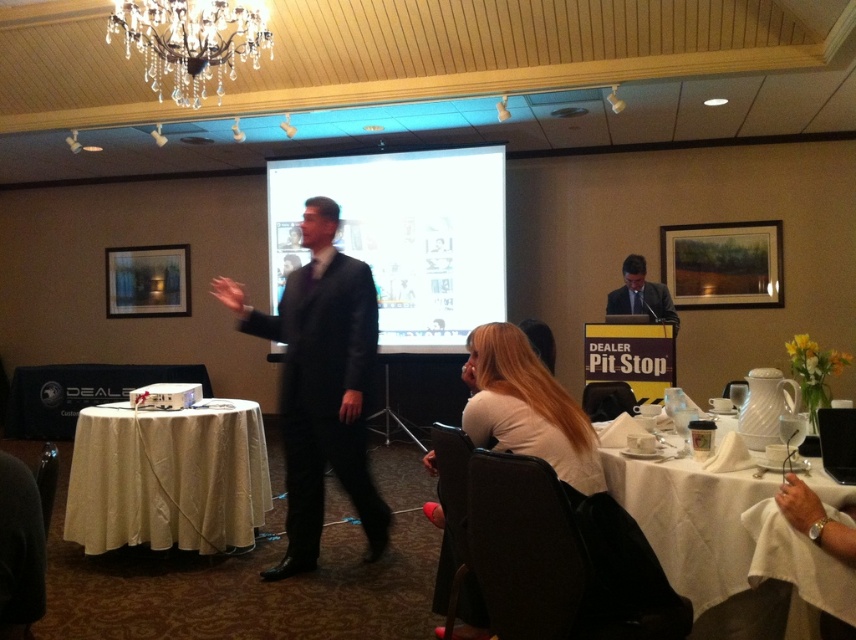
Who is lower down, black suit at center or white matte shirt at lower center?

black suit at center

Looking at this image, does black suit at center have a larger size compared to white matte shirt at lower center?

Yes, black suit at center is bigger than white matte shirt at lower center.

You are a GUI agent. You are given a task and a screenshot of the screen. Output one action in this format:
    pyautogui.click(x=<x>, y=<y>)
    Task: Click on the black suit at center
    This screenshot has width=856, height=640.
    Given the screenshot: What is the action you would take?
    pyautogui.click(x=321, y=385)

At what (x,y) coordinates should I click in order to perform the action: click on black suit at center. Please return your answer as a coordinate pair (x, y). This screenshot has height=640, width=856. Looking at the image, I should click on (321, 385).

Can you confirm if black suit at center is wider than white cloth-covered table at lower right?

Indeed, black suit at center has a greater width compared to white cloth-covered table at lower right.

Who is more forward, (366, 337) or (669, 458)?

Positioned in front is point (669, 458).

Image resolution: width=856 pixels, height=640 pixels. Identify the location of black suit at center. (321, 385).

Looking at this image, is white cloth-covered table at lower right bigger than white plastic projector at lower left?

Yes, white cloth-covered table at lower right is bigger than white plastic projector at lower left.

Can you confirm if white cloth-covered table at lower right is shorter than white plastic projector at lower left?

No.

Locate an element on the screen. The image size is (856, 640). white cloth-covered table at lower right is located at coordinates (685, 513).